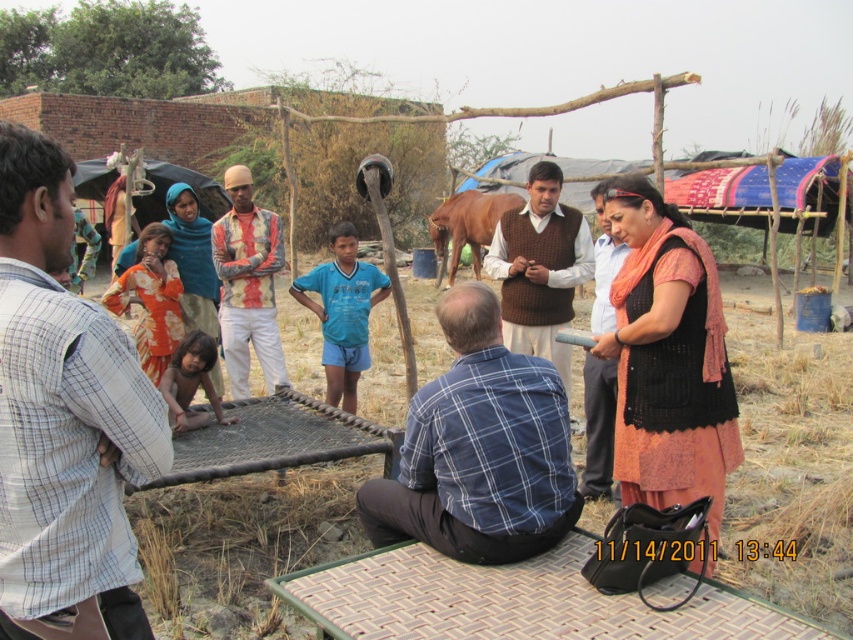
You are an observer standing in front of the scene. You notice two items at the center of the image. Which one is wider, the brown knitted sweater at center or the brown leather horse at center?

The brown leather horse at center is wider than the brown knitted sweater at center, as the brown knitted sweater at center has a smaller width according to the description.

You are a photographer trying to capture a photo of the blue plaid shirt at center and the brown leather horse at center. Which object should you focus on first if you want to include both in your frame without moving your camera?

The blue plaid shirt at center is to the left of the brown leather horse at center, so you should focus on the blue plaid shirt at center first to ensure both are in the frame.

You are a photographer trying to capture a clear shot of both the brown knitted sweater at center and the brown leather horse at center. Since you want both subjects in focus, which one should you adjust your camera focus to prioritize first?

The brown knitted sweater at center is closer to the viewer than the brown leather horse at center, so you should focus on the brown knitted sweater at center first to ensure both are in focus.